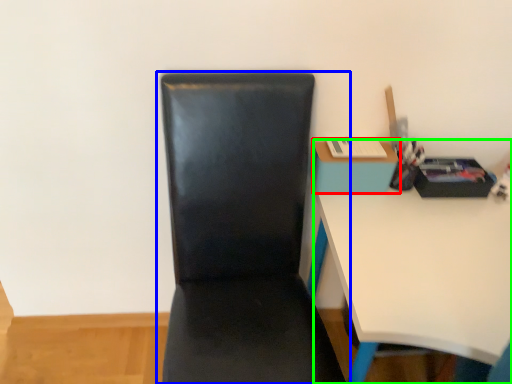
Question: Based on their relative distances, which object is nearer to table (highlighted by a red box)? Choose from chair (highlighted by a blue box) and desk (highlighted by a green box).

Choices:
 (A) chair
 (B) desk

Answer: (B)